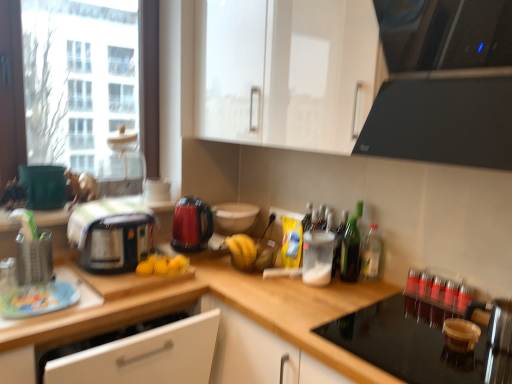
In order to click on free space to the left of green glass bottle at right, the third bottle when ordered from right to left in this screenshot , I will do `click(304, 287)`.